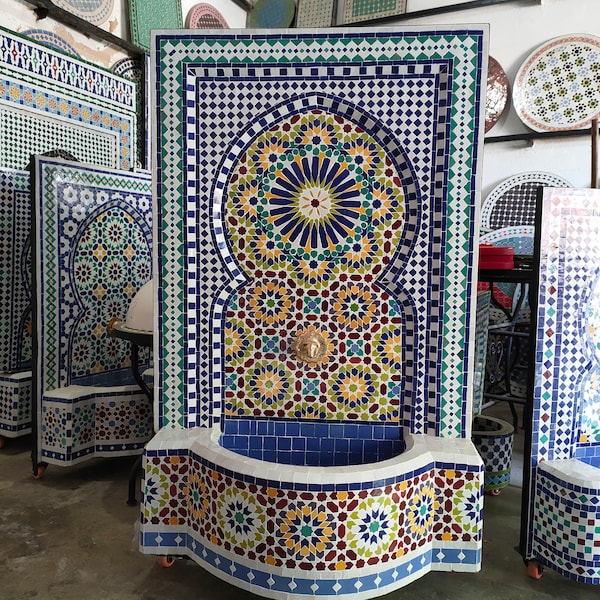
Image resolution: width=600 pixels, height=600 pixels. What are the coordinates of `floor` in the screenshot? It's located at (50, 549).